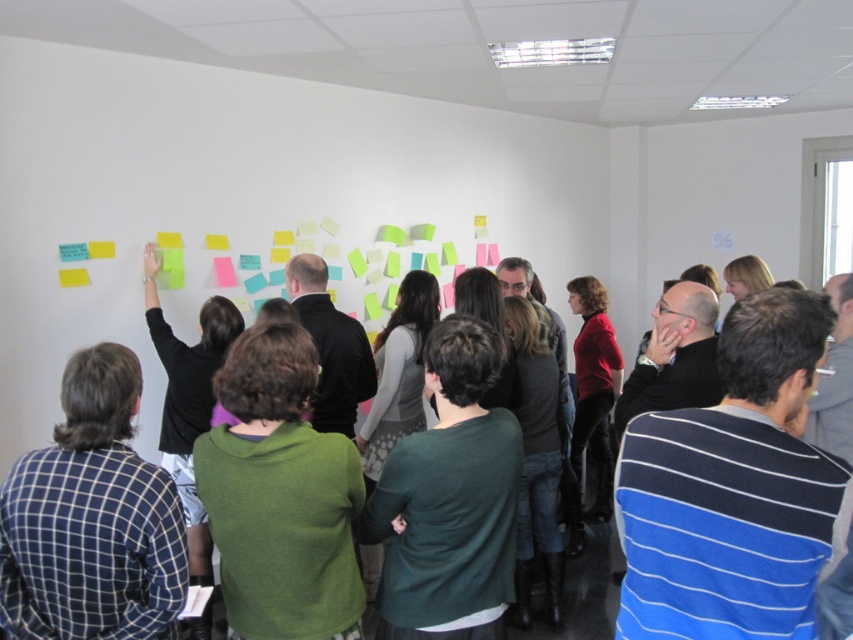
Between blue checkered shirt at left and green sweater at center, which one has more height?

With more height is blue checkered shirt at left.

Who is shorter, blue checkered shirt at left or green sweater at center?

green sweater at center is shorter.

Find the location of a particular element. This screenshot has width=853, height=640. blue checkered shirt at left is located at coordinates (91, 518).

Locate an element on the screen. The width and height of the screenshot is (853, 640). blue checkered shirt at left is located at coordinates (91, 518).

Is blue checkered shirt at left to the right of yellow paper at upper left from the viewer's perspective?

Yes, blue checkered shirt at left is to the right of yellow paper at upper left.

Who is more forward, (164, 573) or (62, 278)?

Point (164, 573)

You are a GUI agent. You are given a task and a screenshot of the screen. Output one action in this format:
    pyautogui.click(x=<x>, y=<y>)
    Task: Click on the blue checkered shirt at left
    This screenshot has height=640, width=853.
    Given the screenshot: What is the action you would take?
    pyautogui.click(x=91, y=518)

Where is `blue checkered shirt at left`? The height and width of the screenshot is (640, 853). blue checkered shirt at left is located at coordinates (91, 518).

Between green sweater at center and yellow paper at upper left, which one appears on the right side from the viewer's perspective?

Positioned to the right is green sweater at center.

Is green sweater at center smaller than yellow paper at upper left?

Actually, green sweater at center might be larger than yellow paper at upper left.

Who is more distant from viewer, (534, 630) or (74, 276)?

Point (534, 630)

This screenshot has height=640, width=853. In order to click on green sweater at center in this screenshot , I will do `click(582, 595)`.